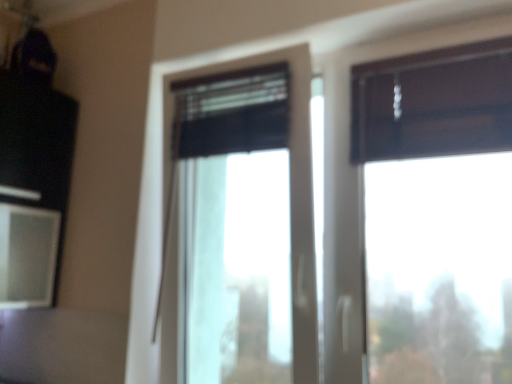
What do you see at coordinates (291, 192) in the screenshot? I see `black matte window at center, arranged as the 2th window when viewed from the right` at bounding box center [291, 192].

Image resolution: width=512 pixels, height=384 pixels. I want to click on matte white screen at left, so click(27, 255).

Find the location of a particular element. This screenshot has width=512, height=384. window screen on the left of black matte window at center, arranged as the 2th window when viewed from the right is located at coordinates (27, 255).

Is black matte window at center, which appears as the first window when viewed from the left, completely or partially inside matte white screen at left?

No, black matte window at center, which appears as the first window when viewed from the left, is not inside matte white screen at left.

Which of these two, matte white screen at left or black matte window at center, which appears as the first window when viewed from the left, stands shorter?

Standing shorter between the two is matte white screen at left.

Which point is more distant from viewer, [9,273] or [302,351]?

Point [9,273]

The height and width of the screenshot is (384, 512). In order to click on window screen below the dark wood window at upper right, which appears as the first window when viewed from the right (from a real-world perspective) in this screenshot , I will do `click(27, 255)`.

From their relative heights in the image, would you say dark wood window at upper right, which is counted as the 2th window, starting from the left, is taller or shorter than matte white screen at left?

Considering their sizes, dark wood window at upper right, which is counted as the 2th window, starting from the left, has more height than matte white screen at left.

Is dark wood window at upper right, which appears as the first window when viewed from the right, next to matte white screen at left and touching it?

No, dark wood window at upper right, which appears as the first window when viewed from the right, is not making contact with matte white screen at left.

Considering the relative sizes of black matte window at center, arranged as the 2th window when viewed from the right, and dark wood window at upper right, which appears as the first window when viewed from the right, in the image provided, is black matte window at center, arranged as the 2th window when viewed from the right, bigger than dark wood window at upper right, which appears as the first window when viewed from the right,?

Indeed, black matte window at center, arranged as the 2th window when viewed from the right, has a larger size compared to dark wood window at upper right, which appears as the first window when viewed from the right.

Locate an element on the screen. The height and width of the screenshot is (384, 512). window lying behind the dark wood window at upper right, which appears as the first window when viewed from the right is located at coordinates (291, 192).

Considering the positions of point (304, 277) and point (472, 372), is point (304, 277) closer or farther from the camera than point (472, 372)?

Point (304, 277).

From the picture: From a real-world perspective, who is located higher, black matte window at center, arranged as the 2th window when viewed from the right, or dark wood window at upper right, which is counted as the 2th window, starting from the left?

dark wood window at upper right, which is counted as the 2th window, starting from the left.

How different are the orientations of matte white screen at left and dark wood window at upper right, which is counted as the 2th window, starting from the left, in degrees?

The angular difference between matte white screen at left and dark wood window at upper right, which is counted as the 2th window, starting from the left, is 92 degrees.

In terms of width, does matte white screen at left look wider or thinner when compared to dark wood window at upper right, which appears as the first window when viewed from the right?

matte white screen at left is wider than dark wood window at upper right, which appears as the first window when viewed from the right.

Are matte white screen at left and dark wood window at upper right, which is counted as the 2th window, starting from the left, making contact?

There is a gap between matte white screen at left and dark wood window at upper right, which is counted as the 2th window, starting from the left.

Is dark wood window at upper right, which is counted as the 2th window, starting from the left, a part of matte white screen at left?

No.

Considering the sizes of objects dark wood window at upper right, which appears as the first window when viewed from the right, and black matte window at center, arranged as the 2th window when viewed from the right, in the image provided, who is smaller, dark wood window at upper right, which appears as the first window when viewed from the right, or black matte window at center, arranged as the 2th window when viewed from the right,?

With smaller size is dark wood window at upper right, which appears as the first window when viewed from the right.

The image size is (512, 384). What are the coordinates of `window behind the dark wood window at upper right, which appears as the first window when viewed from the right` in the screenshot? It's located at (291, 192).

Which of these two, dark wood window at upper right, which appears as the first window when viewed from the right, or black matte window at center, arranged as the 2th window when viewed from the right, stands taller?

black matte window at center, arranged as the 2th window when viewed from the right.

Is dark wood window at upper right, which is counted as the 2th window, starting from the left, placed right next to black matte window at center, which appears as the first window when viewed from the left?

dark wood window at upper right, which is counted as the 2th window, starting from the left, is not next to black matte window at center, which appears as the first window when viewed from the left, and they're not touching.

From the picture: Which is farther, (303, 278) or (31, 265)?

The point (31, 265) is farther.

From the image's perspective, is black matte window at center, which appears as the first window when viewed from the left, over matte white screen at left?

Correct, black matte window at center, which appears as the first window when viewed from the left, appears higher than matte white screen at left in the image.

Does black matte window at center, arranged as the 2th window when viewed from the right, have a larger size compared to matte white screen at left?

Yes, black matte window at center, arranged as the 2th window when viewed from the right, is bigger than matte white screen at left.

Starting from the matte white screen at left, which window is the 1st one to the right? Please provide its 2D coordinates.

[(291, 192)]

Where is `window screen behind the dark wood window at upper right, which is counted as the 2th window, starting from the left`? window screen behind the dark wood window at upper right, which is counted as the 2th window, starting from the left is located at coordinates coord(27,255).

Looking at the image, which one is located closer to dark wood window at upper right, which is counted as the 2th window, starting from the left, matte white screen at left or black matte window at center, arranged as the 2th window when viewed from the right?

Based on the image, black matte window at center, arranged as the 2th window when viewed from the right, appears to be nearer to dark wood window at upper right, which is counted as the 2th window, starting from the left.

From the picture: Which object lies further to the anchor point black matte window at center, arranged as the 2th window when viewed from the right, matte white screen at left or dark wood window at upper right, which is counted as the 2th window, starting from the left?

dark wood window at upper right, which is counted as the 2th window, starting from the left.

Which object lies further to the anchor point dark wood window at upper right, which is counted as the 2th window, starting from the left, black matte window at center, arranged as the 2th window when viewed from the right, or matte white screen at left?

Based on the image, matte white screen at left appears to be further to dark wood window at upper right, which is counted as the 2th window, starting from the left.

Considering their positions, is dark wood window at upper right, which is counted as the 2th window, starting from the left, positioned closer to black matte window at center, arranged as the 2th window when viewed from the right, than matte white screen at left?

matte white screen at left is positioned closer to the anchor black matte window at center, arranged as the 2th window when viewed from the right.

Considering their positions, is dark wood window at upper right, which is counted as the 2th window, starting from the left, positioned closer to matte white screen at left than black matte window at center, arranged as the 2th window when viewed from the right?

black matte window at center, arranged as the 2th window when viewed from the right, is positioned closer to the anchor matte white screen at left.

From the picture: Looking at the image, which one is located further to matte white screen at left, black matte window at center, which appears as the first window when viewed from the left, or dark wood window at upper right, which appears as the first window when viewed from the right?

The object further to matte white screen at left is dark wood window at upper right, which appears as the first window when viewed from the right.

Find the location of a particular element. The image size is (512, 384). window between matte white screen at left and dark wood window at upper right, which is counted as the 2th window, starting from the left is located at coordinates (291, 192).